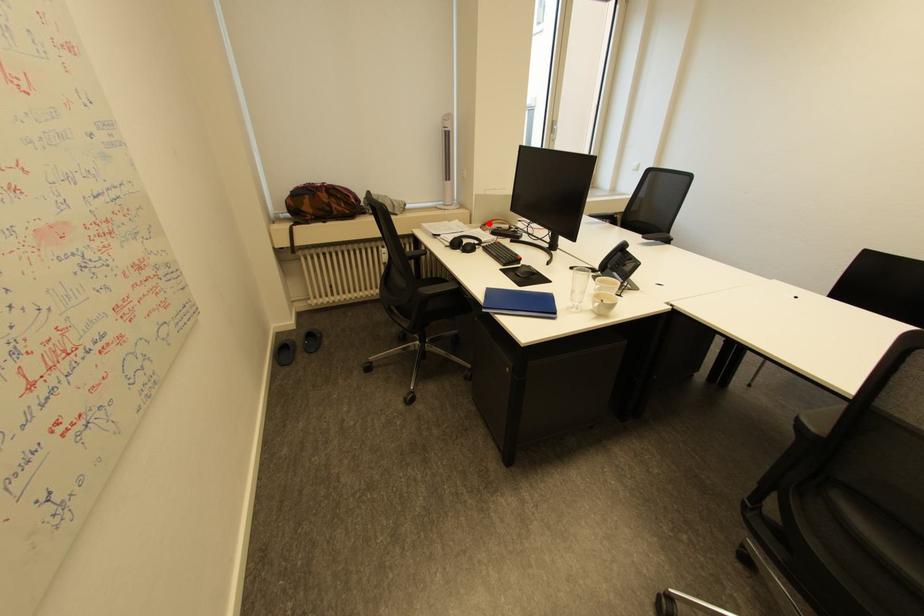
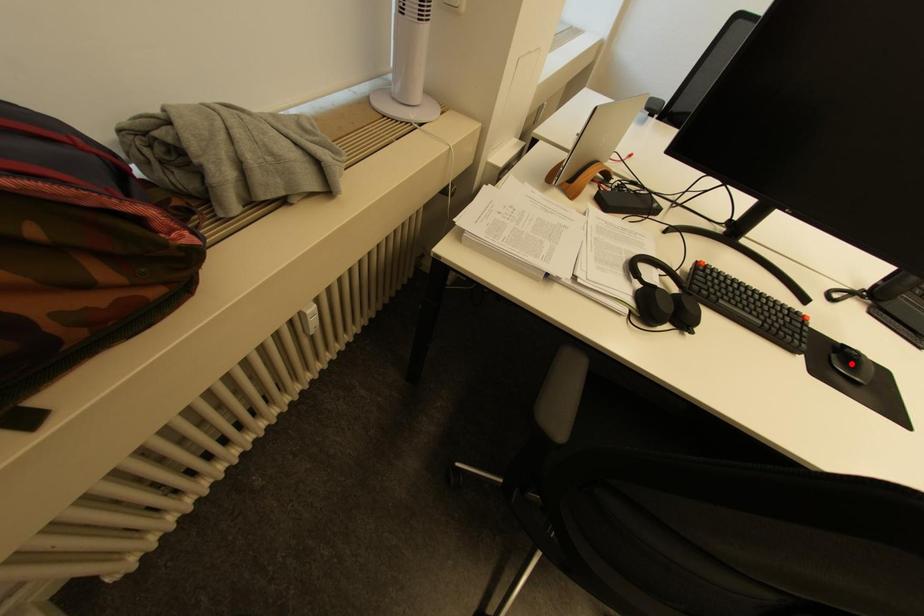
I am providing you with two images of the same scene from different viewpoints. A red point is marked on the first image and another point is marked on the second image. Is the marked point in image1 the same physical position as the marked point in image2?

No